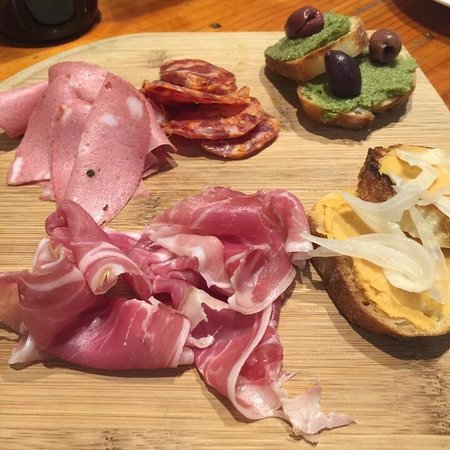
This screenshot has width=450, height=450. In order to click on wooden tray in this screenshot , I will do `click(317, 356)`, `click(163, 404)`, `click(300, 163)`, `click(429, 120)`, `click(140, 50)`, `click(26, 209)`.